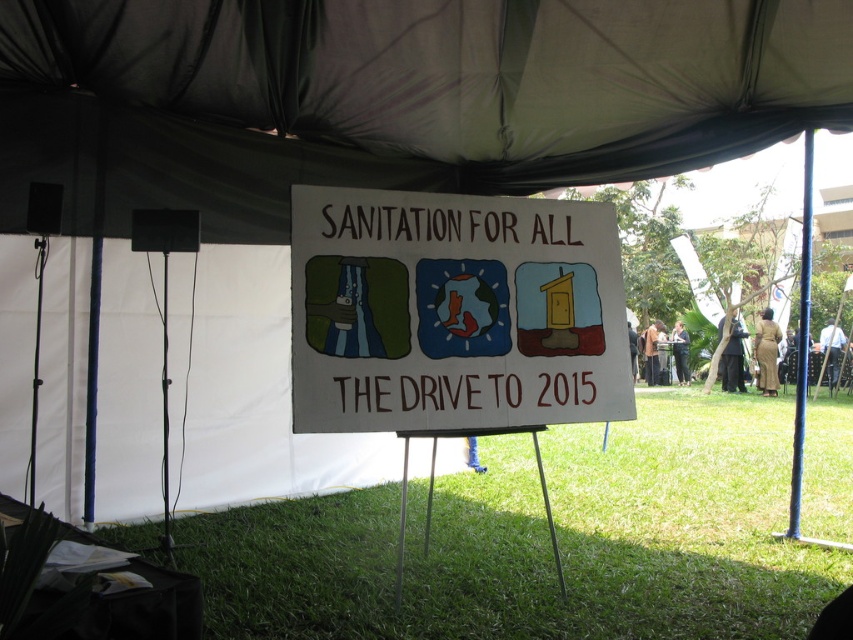
Question: Observing the image, what is the correct spatial positioning of white fabric canopy at upper center in reference to white paper sign at center?

Choices:
 (A) below
 (B) above

Answer: (B)

Question: Can you confirm if white fabric canopy at upper center is thinner than white paper sign at center?

Choices:
 (A) yes
 (B) no

Answer: (B)

Question: Based on their relative distances, which object is nearer to the white paper sign at center?

Choices:
 (A) green grass at center
 (B) white fabric canopy at upper center

Answer: (B)

Question: Which of the following is the farthest from the observer?

Choices:
 (A) (577, 296)
 (B) (693, 502)

Answer: (B)

Question: Can you confirm if white fabric canopy at upper center is positioned below white paper sign at center?

Choices:
 (A) no
 (B) yes

Answer: (A)

Question: Which object is positioned farthest from the green grass at center?

Choices:
 (A) white paper sign at center
 (B) white fabric canopy at upper center

Answer: (B)